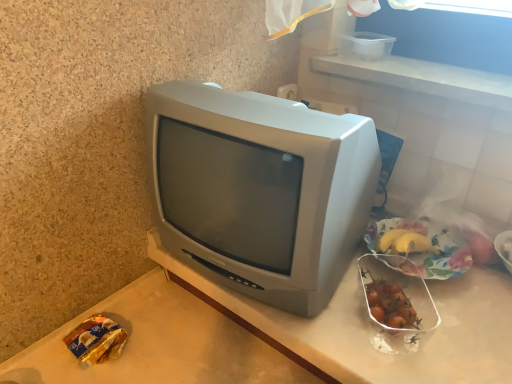
Question: Is translucent plastic banana at upper right, the 4th food positioned from the left, wider or thinner than shiny plastic container of cherry tomatoes at right, the third food in the right-to-left sequence?

Choices:
 (A) thin
 (B) wide

Answer: (A)

Question: From a real-world perspective, is translucent plastic banana at upper right, the 1th food positioned from the right, positioned above or below shiny plastic container of cherry tomatoes at right, arranged as the second food when viewed from the left?

Choices:
 (A) below
 (B) above

Answer: (B)

Question: Which object is positioned farthest from the translucent plastic banana at upper right, the 4th food positioned from the left?

Choices:
 (A) shiny plastic container of cherry tomatoes at right, the third food in the right-to-left sequence
 (B) yellow matte bananas at right, which appears as the second food when viewed from the right
 (C) gold foil snack at lower left, placed as the 1th food when sorted from left to right
 (D) matte gray television at center

Answer: (C)

Question: Which object is the closest to the translucent plastic banana at upper right, the 4th food positioned from the left?

Choices:
 (A) shiny plastic container of cherry tomatoes at right, the third food in the right-to-left sequence
 (B) yellow matte bananas at right, the third food in the left-to-right sequence
 (C) matte gray television at center
 (D) gold foil snack at lower left, the 4th food when ordered from right to left

Answer: (B)